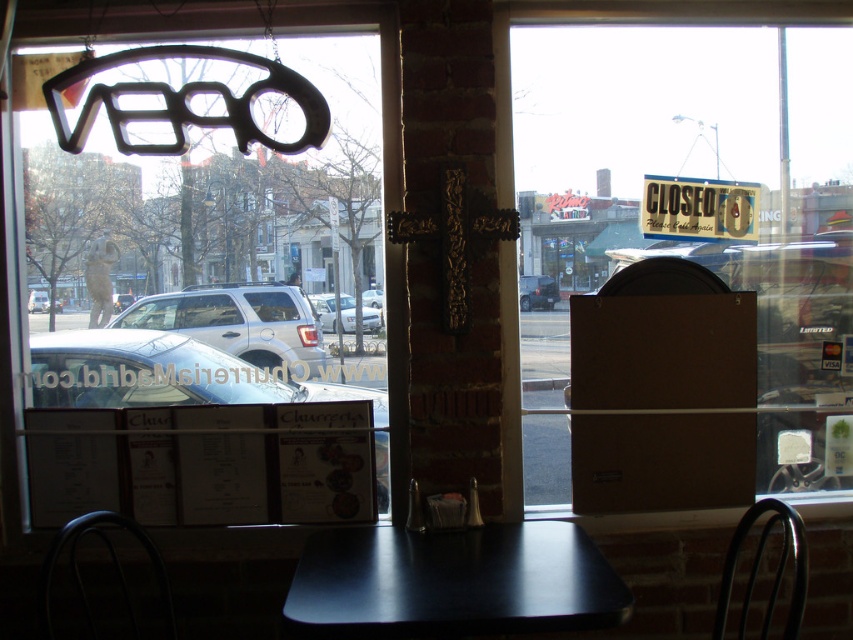
Question: Is black matte table at center positioned behind black metal chair at lower left?

Choices:
 (A) yes
 (B) no

Answer: (B)

Question: Is black matte sign at upper center positioned in front of black matte table at center?

Choices:
 (A) no
 (B) yes

Answer: (A)

Question: Does brown cardboard box at center have a smaller size compared to wooden sign at center?

Choices:
 (A) no
 (B) yes

Answer: (A)

Question: Among these points, which one is nearest to the camera?

Choices:
 (A) (676, 180)
 (B) (102, 528)

Answer: (B)

Question: Which point is farther to the camera?

Choices:
 (A) (788, 244)
 (B) (769, 612)

Answer: (A)

Question: Which point is closer to the camera taking this photo?

Choices:
 (A) (766, 77)
 (B) (805, 561)
 (C) (56, 552)

Answer: (B)